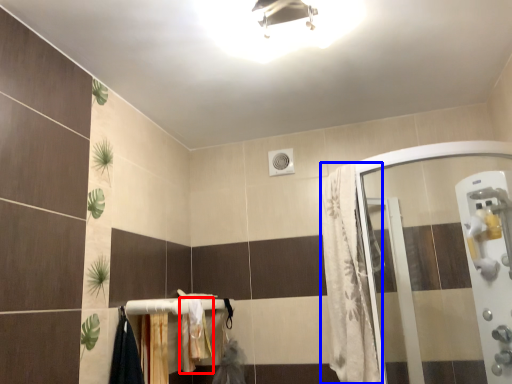
Question: Which of the following is the closest to the observer, bath towel (highlighted by a red box) or shower curtain (highlighted by a blue box)?

Choices:
 (A) bath towel
 (B) shower curtain

Answer: (B)